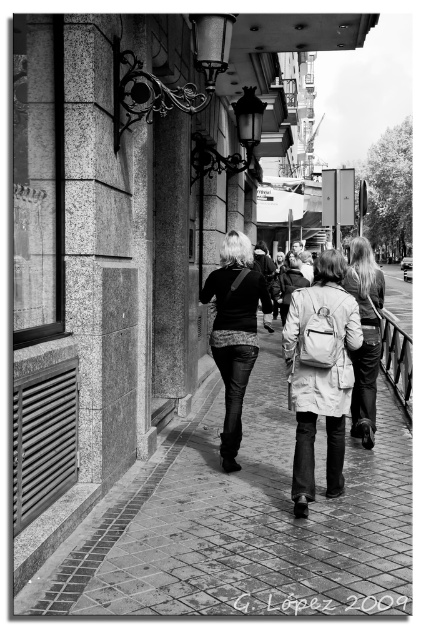
Does brick pavement at center have a greater width compared to matte beige coat at center?

Indeed, brick pavement at center has a greater width compared to matte beige coat at center.

Who is lower down, brick pavement at center or matte beige coat at center?

brick pavement at center is below.

Is point (288, 576) less distant than point (351, 285)?

Yes, point (288, 576) is closer to viewer.

The width and height of the screenshot is (426, 640). Identify the location of brick pavement at center. (241, 522).

Is light beige coat at center positioned at the back of matte beige coat at center?

No.

Identify the location of light beige coat at center. This screenshot has height=640, width=426. (321, 378).

Is point (351, 324) positioned before point (363, 342)?

Yes, it is in front of point (363, 342).

Locate an element on the screen. This screenshot has height=640, width=426. light beige coat at center is located at coordinates (321, 378).

Does light beige coat at center have a larger size compared to leather jacket at center?

Yes, light beige coat at center is bigger than leather jacket at center.

Consider the image. Is light beige coat at center to the left of leather jacket at center from the viewer's perspective?

No, light beige coat at center is not to the left of leather jacket at center.

Locate an element on the screen. light beige coat at center is located at coordinates (321, 378).